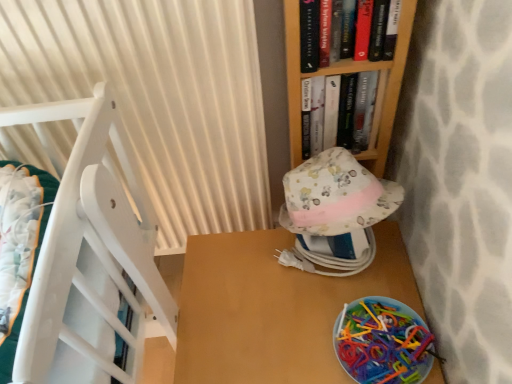
Find the location of a particular element. free spot above translucent plastic toys at lower right (from a real-world perspective) is located at coordinates (384, 332).